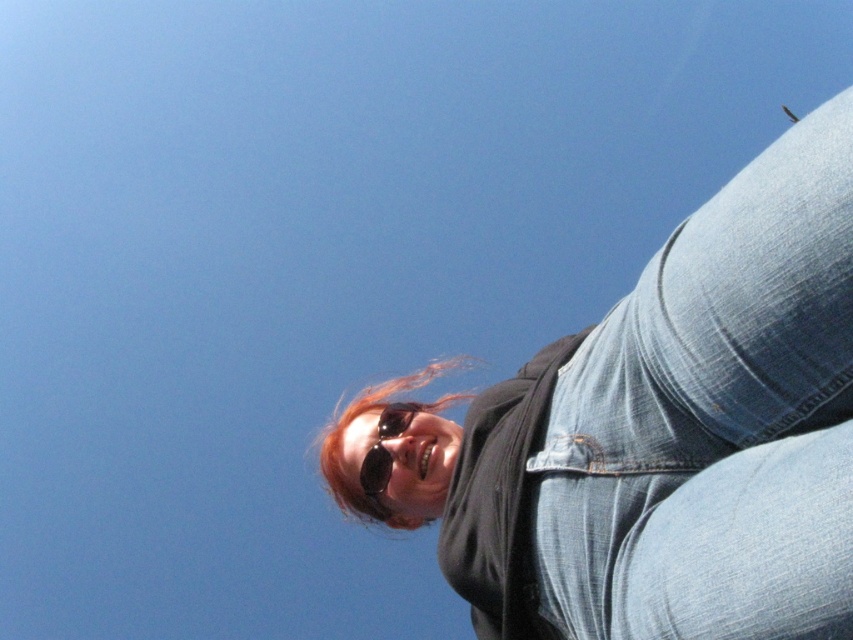
The image size is (853, 640). Identify the location of denim at right. (714, 420).

Is denim at right shorter than black reflective sunglasses at center?

No.

Does point (581, 353) lie in front of point (361, 468)?

Yes.

You are a GUI agent. You are given a task and a screenshot of the screen. Output one action in this format:
    pyautogui.click(x=<x>, y=<y>)
    Task: Click on the denim at right
    This screenshot has width=853, height=640.
    Given the screenshot: What is the action you would take?
    pyautogui.click(x=714, y=420)

Between blonde hair at center and black reflective sunglasses at center, which one is positioned higher?

black reflective sunglasses at center is above.

Is blonde hair at center thinner than black reflective sunglasses at center?

Incorrect, blonde hair at center's width is not less than black reflective sunglasses at center's.

Is point (332, 465) behind point (405, 428)?

Yes, it is.

You are a GUI agent. You are given a task and a screenshot of the screen. Output one action in this format:
    pyautogui.click(x=<x>, y=<y>)
    Task: Click on the blonde hair at center
    The image size is (853, 640).
    Given the screenshot: What is the action you would take?
    pyautogui.click(x=349, y=422)

Does denim at right have a larger size compared to blonde hair at center?

No.

Between point (683, 515) and point (393, 378), which one is positioned behind?

The point (393, 378) is behind.

Locate an element on the screen. denim at right is located at coordinates (714, 420).

This screenshot has width=853, height=640. I want to click on denim at right, so click(x=714, y=420).